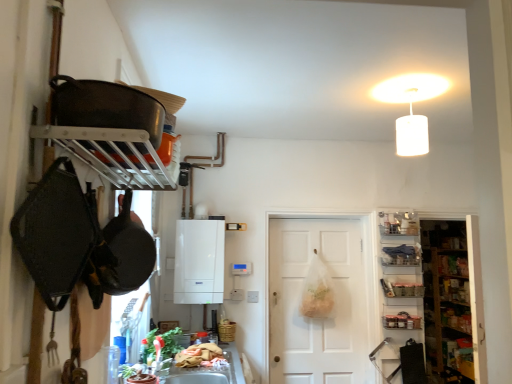
Question: From a real-world perspective, is metallic glass jars at right physically located above or below metallic silver shelf at upper right, which is the third shelf in bottom-to-top order?

Choices:
 (A) above
 (B) below

Answer: (B)

Question: Visually, is metallic glass jars at right positioned to the left or to the right of metallic silver shelf at upper right, arranged as the 1th shelf when viewed from the top?

Choices:
 (A) right
 (B) left

Answer: (A)

Question: Which object is positioned closest to the metallic silver tray at right, placed as the 1th shelf when sorted from bottom to top?

Choices:
 (A) wooden shelves at right
 (B) metallic silver shelf at upper right, arranged as the 1th shelf when viewed from the top
 (C) white matte door at center
 (D) shiny black frying pan at upper left
 (E) white matte boiler at center

Answer: (B)

Question: Estimate the real-world distances between objects in this image. Which object is closer to the matte plastic shelf at right, marked as the second shelf in a bottom-to-top arrangement?

Choices:
 (A) wooden shelves at right
 (B) shiny black frying pan at upper left
 (C) metallic silver shelf at upper right, which is the third shelf in bottom-to-top order
 (D) metallic glass jars at right
 (E) metallic silver tray at right, placed as the 1th shelf when sorted from bottom to top

Answer: (E)